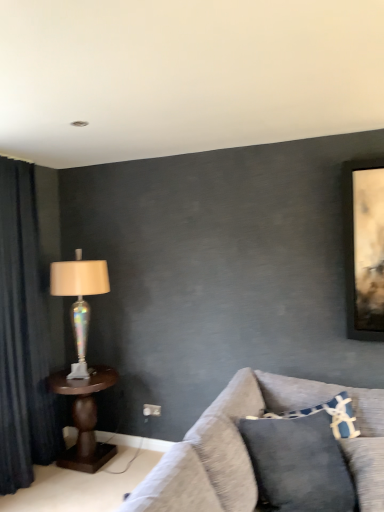
Question: Is textured gray couch at lower right taller or shorter than dark blue fabric curtain at left?

Choices:
 (A) short
 (B) tall

Answer: (A)

Question: Considering their positions, is textured gray couch at lower right located in front of or behind dark blue fabric curtain at left?

Choices:
 (A) behind
 (B) front

Answer: (B)

Question: Which object is the farthest from the brown wooden table at left?

Choices:
 (A) dark blue fabric curtain at left
 (B) blue textured pillow at lower right
 (C) iridescent glass lamp at left
 (D) textured gray couch at lower right

Answer: (B)

Question: Which of these objects is positioned closest to the blue textured pillow at lower right?

Choices:
 (A) brown wooden table at left
 (B) textured gray couch at lower right
 (C) iridescent glass lamp at left
 (D) dark blue fabric curtain at left

Answer: (B)